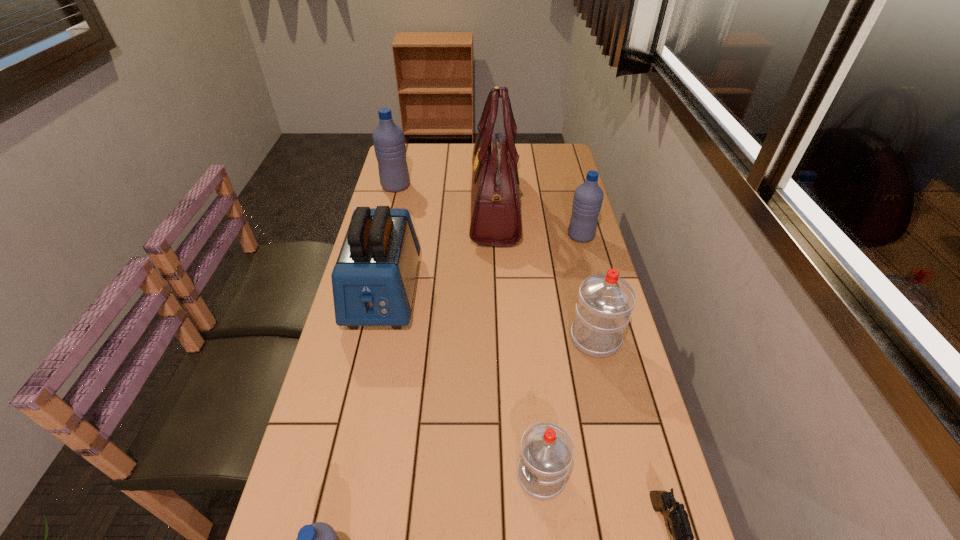
You are a GUI agent. You are given a task and a screenshot of the screen. Output one action in this format:
    pyautogui.click(x=<x>, y=<y>)
    Task: Click on the handbag
    This screenshot has width=960, height=540.
    Given the screenshot: What is the action you would take?
    (x=496, y=221)

Find the location of a particular element. This screenshot has width=960, height=540. the tallest object is located at coordinates (496, 221).

The width and height of the screenshot is (960, 540). Identify the location of the tallest water bottle. (388, 139).

I want to click on the farthest blue water bottle, so click(x=388, y=139).

The height and width of the screenshot is (540, 960). What are the coordinates of `toaster` in the screenshot? It's located at (373, 280).

Identify the location of the second farthest blue water bottle. The width and height of the screenshot is (960, 540). (588, 197).

Locate an element on the screen. The image size is (960, 540). the fourth nearest water bottle is located at coordinates (588, 197).

Locate an element on the screen. The image size is (960, 540). the right white water bottle is located at coordinates (605, 301).

Locate an element on the screen. The image size is (960, 540). the farther white water bottle is located at coordinates (605, 301).

The image size is (960, 540). What are the coordinates of `the left white water bottle` in the screenshot? It's located at (547, 450).